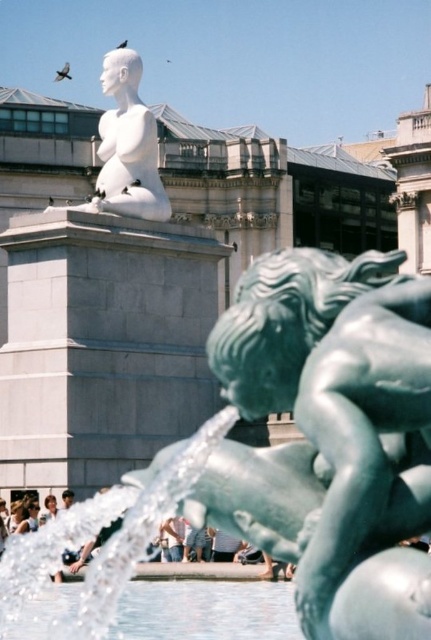
Question: Which point is closer to the camera?

Choices:
 (A) (15, 637)
 (B) (90, 205)

Answer: (A)

Question: Which of the following is the closest to the observer?

Choices:
 (A) (227, 580)
 (B) (418, 483)

Answer: (B)

Question: Is clear water at fountain center bigger than white marble statue at upper center?

Choices:
 (A) yes
 (B) no

Answer: (B)

Question: Can you confirm if green polished stone fountain at center is wider than white marble statue at upper center?

Choices:
 (A) no
 (B) yes

Answer: (A)

Question: Is green polished stone fountain at center to the right of clear water at fountain center from the viewer's perspective?

Choices:
 (A) yes
 (B) no

Answer: (B)

Question: Which of the following is the farthest from the observer?

Choices:
 (A) (247, 605)
 (B) (156, 134)
 (C) (290, 515)

Answer: (B)